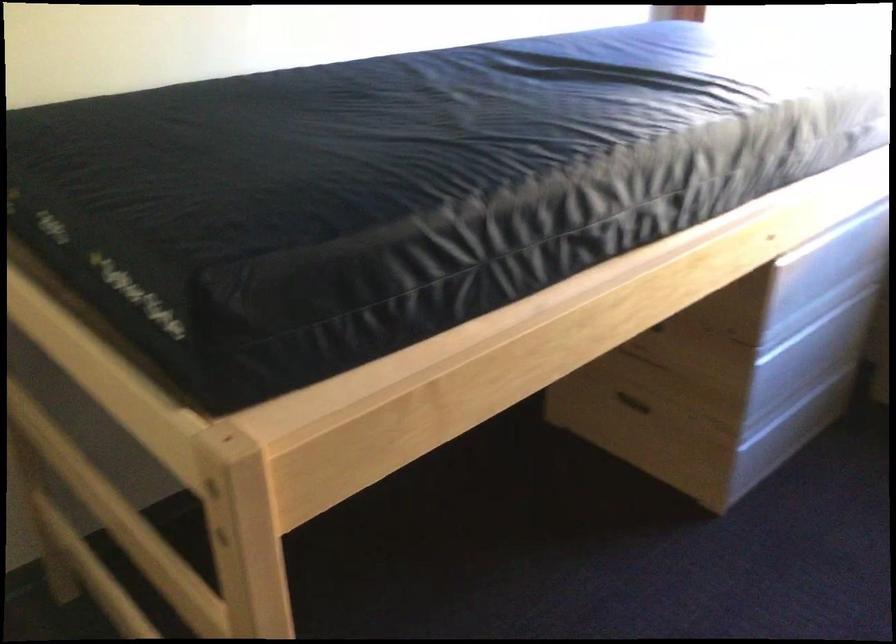
Find where to pull the dark drawer handle. Please return your answer as a coordinate pair (x, y).

(633, 402)